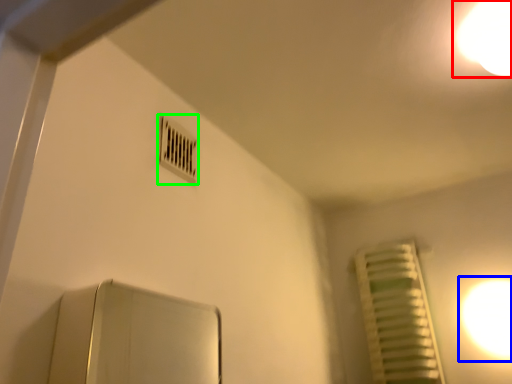
Question: Which object is positioned closest to light (highlighted by a red box)? Select from light (highlighted by a blue box) and air conditioning (highlighted by a green box).

Choices:
 (A) light
 (B) air conditioning

Answer: (B)